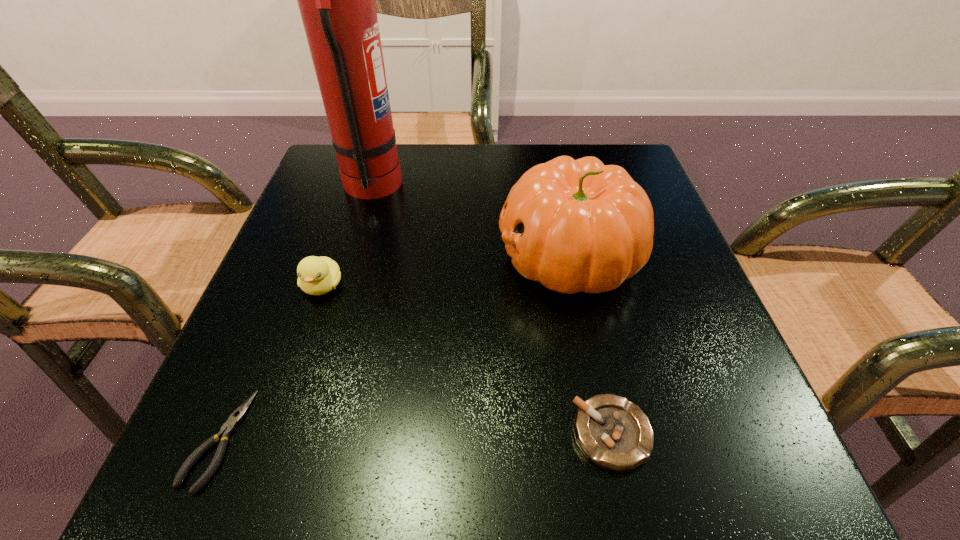
This screenshot has width=960, height=540. What are the coordinates of `pumpkin that is at the right edge` in the screenshot? It's located at (578, 225).

I want to click on ashtray that is at the right edge, so click(612, 432).

The image size is (960, 540). Find the location of `object at the far left corner`. object at the far left corner is located at coordinates (336, 0).

You are a GUI agent. You are given a task and a screenshot of the screen. Output one action in this format:
    pyautogui.click(x=<x>, y=<y>)
    Task: Click on the object that is positioned at the near left corner
    
    Given the screenshot: What is the action you would take?
    pyautogui.click(x=228, y=428)

You are a GUI agent. You are given a task and a screenshot of the screen. Output one action in this format:
    pyautogui.click(x=<x>, y=<y>)
    Task: Click on the object that is at the near right corner
    
    Given the screenshot: What is the action you would take?
    [x=612, y=432]

Find the location of a particular element. This screenshot has height=540, width=960. vacant space at the far edge of the desktop is located at coordinates (425, 187).

What are the coordinates of `vacant space at the near edge of the desktop` in the screenshot? It's located at (428, 485).

Find the location of a particular element. free space at the left edge of the desktop is located at coordinates [271, 366].

Identify the location of blank space at the right edge. The image size is (960, 540). (730, 421).

You are a GUI agent. You are given a task and a screenshot of the screen. Output one action in this format:
    pyautogui.click(x=<x>, y=<y>)
    Task: Click on the vacant region at the far left corner of the desktop
    The height and width of the screenshot is (540, 960).
    Given the screenshot: What is the action you would take?
    pyautogui.click(x=314, y=172)